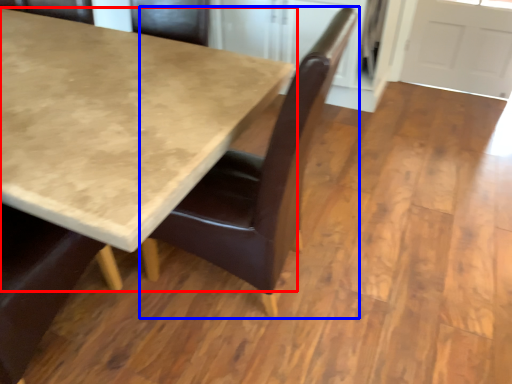
Question: Which object appears closest to the camera in this image, table (highlighted by a red box) or chair (highlighted by a blue box)?

Choices:
 (A) table
 (B) chair

Answer: (A)